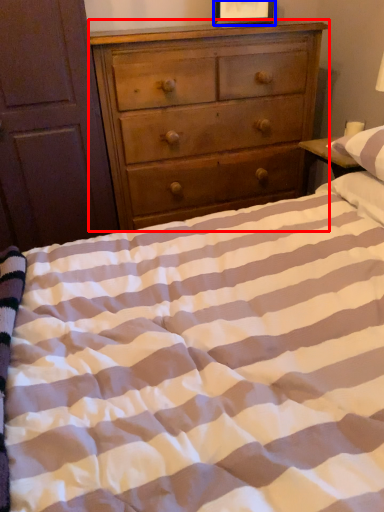
Question: Which object appears closest to the camera in this image, chest of drawers (highlighted by a red box) or picture frame (highlighted by a blue box)?

Choices:
 (A) chest of drawers
 (B) picture frame

Answer: (A)